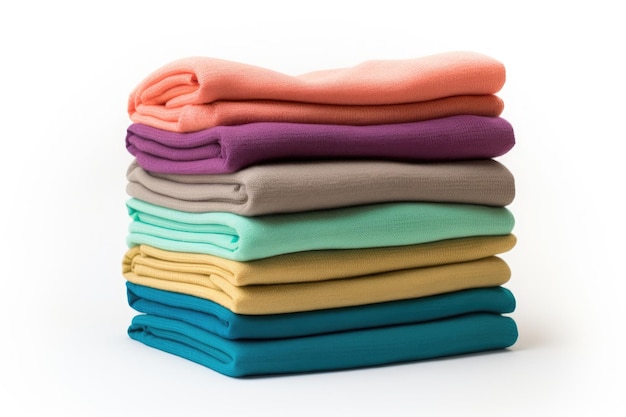
The image size is (626, 417). In order to click on folded blankets in this screenshot , I will do `click(277, 364)`, `click(299, 331)`, `click(317, 301)`, `click(331, 271)`, `click(351, 235)`, `click(364, 190)`, `click(381, 140)`, `click(402, 110)`, `click(424, 82)`.